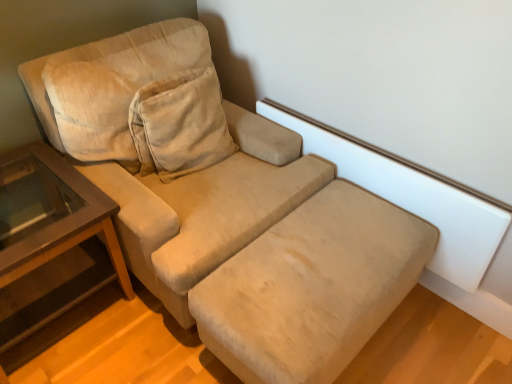
Question: Is brown wood table at left smaller than beige fabric footrest at lower center?

Choices:
 (A) no
 (B) yes

Answer: (A)

Question: Would you say brown wood table at left contains beige fabric footrest at lower center?

Choices:
 (A) yes
 (B) no

Answer: (B)

Question: Considering the relative sizes of brown wood table at left and beige fabric footrest at lower center in the image provided, is brown wood table at left shorter than beige fabric footrest at lower center?

Choices:
 (A) yes
 (B) no

Answer: (B)

Question: Is brown wood table at left thinner than beige fabric footrest at lower center?

Choices:
 (A) no
 (B) yes

Answer: (A)

Question: Does brown wood table at left appear on the left side of beige fabric footrest at lower center?

Choices:
 (A) yes
 (B) no

Answer: (A)

Question: Is the depth of brown wood table at left greater than that of beige fabric footrest at lower center?

Choices:
 (A) yes
 (B) no

Answer: (A)

Question: From the image's perspective, would you say beige fabric footrest at lower center is shown under brown wood table at left?

Choices:
 (A) no
 (B) yes

Answer: (B)

Question: Can you confirm if beige fabric footrest at lower center is wider than brown wood table at left?

Choices:
 (A) no
 (B) yes

Answer: (A)

Question: Is beige fabric footrest at lower center next to brown wood table at left and touching it?

Choices:
 (A) no
 (B) yes

Answer: (A)

Question: Is beige fabric footrest at lower center outside of brown wood table at left?

Choices:
 (A) yes
 (B) no

Answer: (A)

Question: Does beige fabric footrest at lower center contain brown wood table at left?

Choices:
 (A) yes
 (B) no

Answer: (B)

Question: Does beige fabric footrest at lower center have a greater height compared to brown wood table at left?

Choices:
 (A) yes
 (B) no

Answer: (B)

Question: From a real-world perspective, is beige fabric footrest at lower center above or below brown wood table at left?

Choices:
 (A) above
 (B) below

Answer: (B)